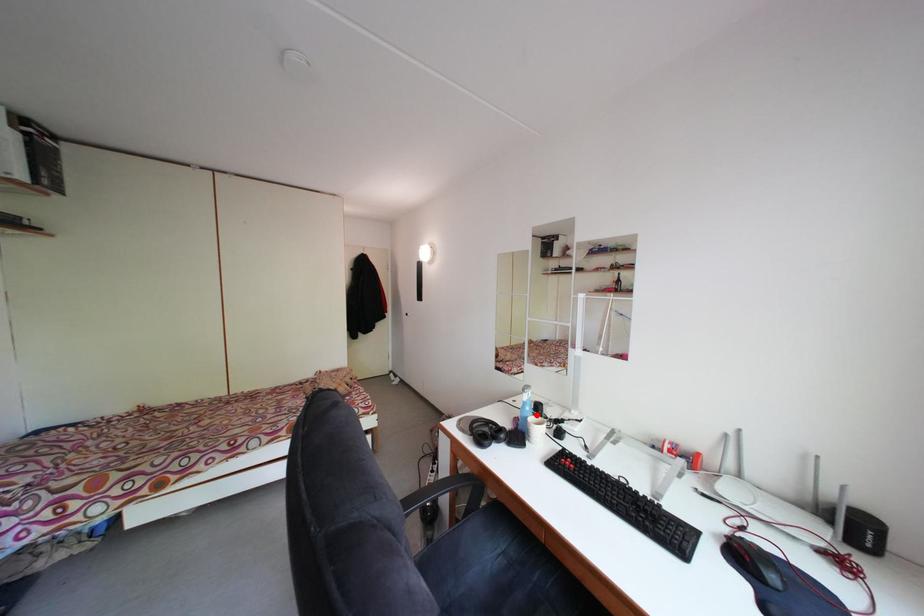
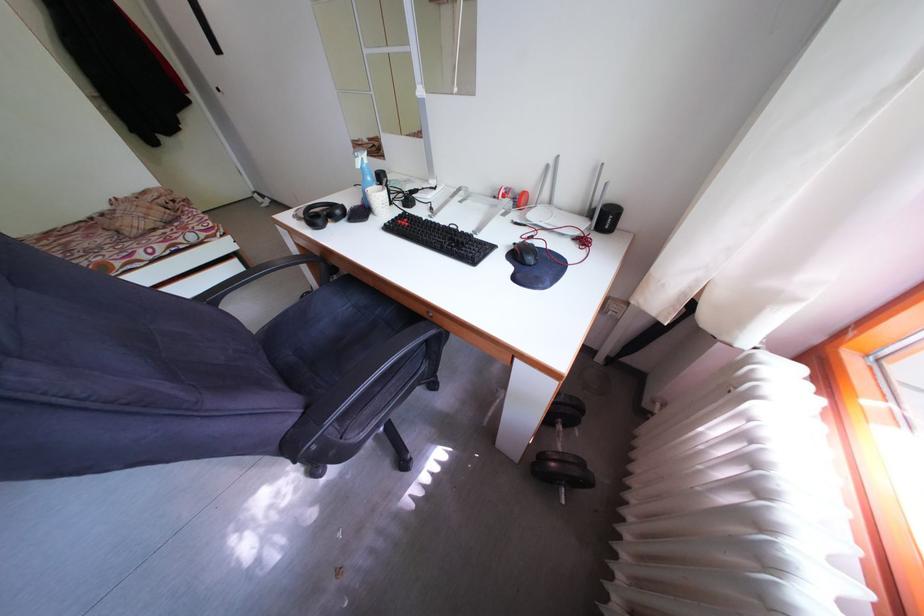
Question: I am providing you with two images of the same scene from different viewpoints. Image1 has a red point marked. In image2, the corresponding 3D location appears at what relative position? Reply with the corresponding letter.

Choices:
 (A) Closer
 (B) Farther

Answer: (A)